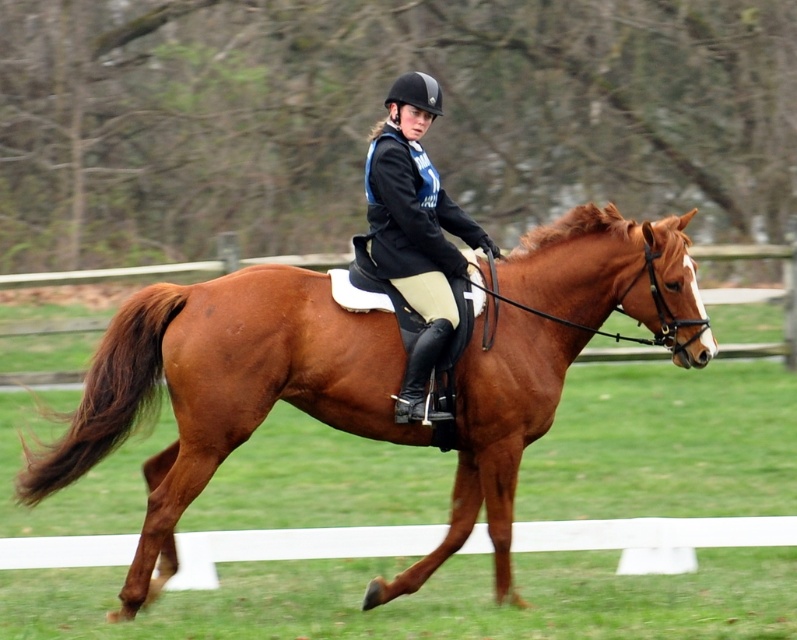
You are a photographer setting up a shot of the rider and horse. You need to ensure the horse takes up most of the frame. Given the brown glossy horse at center and the matte black helmet at center, which object should you focus on to achieve this?

The brown glossy horse at center is wider than the matte black helmet at center, so focusing on the horse will allow it to take up most of the frame.

You are a photographer planning to take a portrait of the rider and horse. You want to ensure the brown glossy horse at center and the matte black helmet at center are both in the frame. Based on their positions, which object should you focus on first to ensure both are in the shot?

The brown glossy horse at center is positioned on the left side of the matte black helmet at center. To ensure both are in the frame, focus on the matte black helmet at center first, as it is on the right, allowing the horse to be captured to its left.

You are a photographer standing at the edge of the grassy field. You want to capture a photo where the brown glossy horse at center is clearly visible above the matte black helmet at center. Is this possible given their sizes?

Yes, the brown glossy horse at center is taller than the matte black helmet at center, so it can be positioned to be visible above it in the photo.